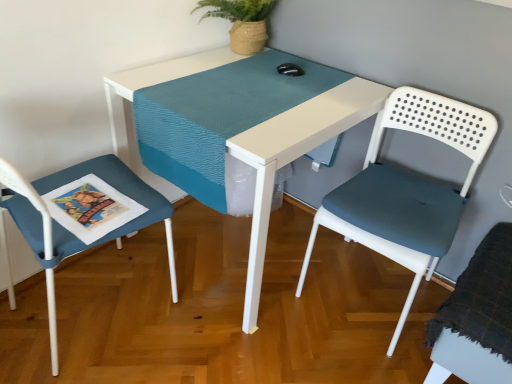
At what (x,y) coordinates should I click in order to perform the action: click on free region under white plastic chair at right, which appears as the 2th chair when viewed from the left (from a real-world perspective). Please return your answer as a coordinate pair (x, y). The height and width of the screenshot is (384, 512). Looking at the image, I should click on (369, 292).